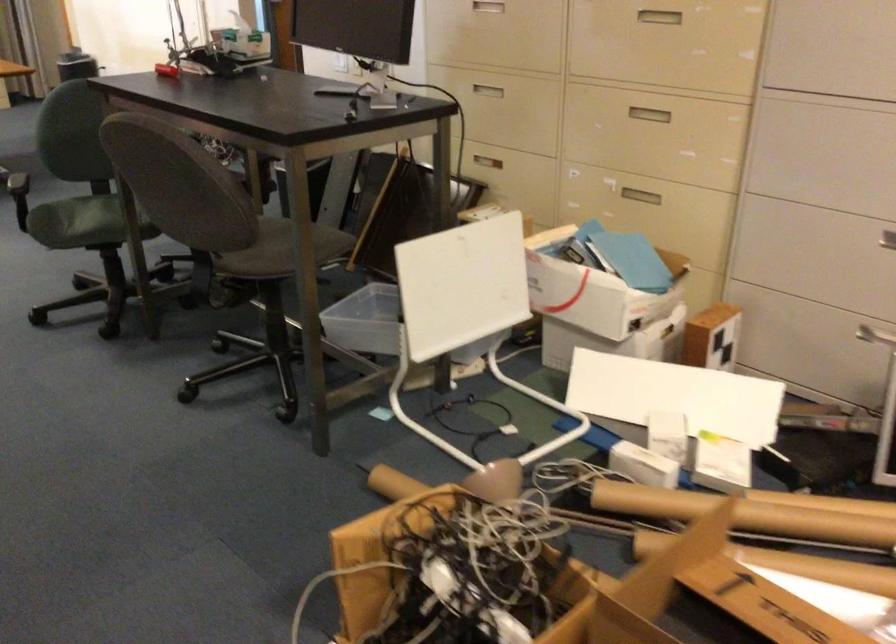
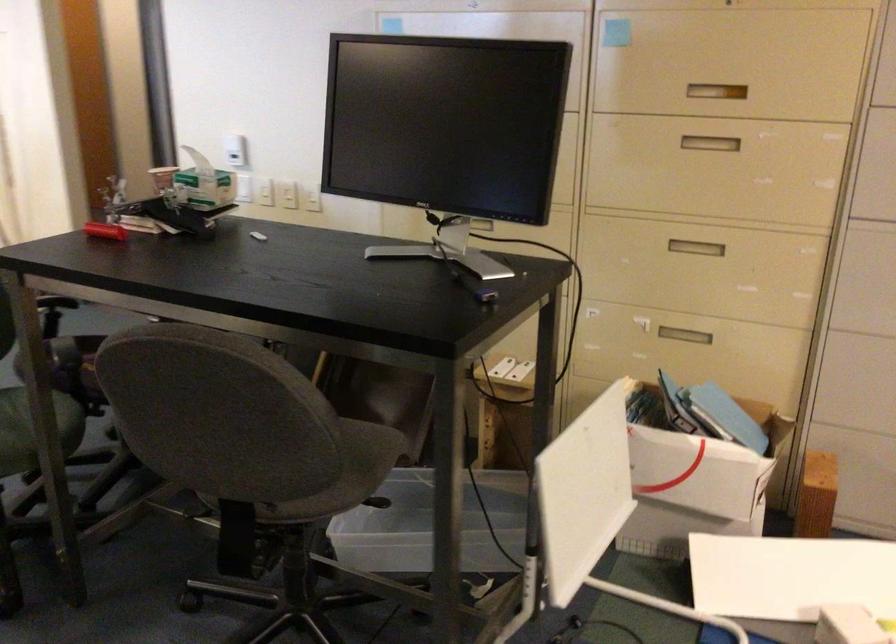
Where in the second image is the point corresponding to the point at 648,111 from the first image?

(695, 247)